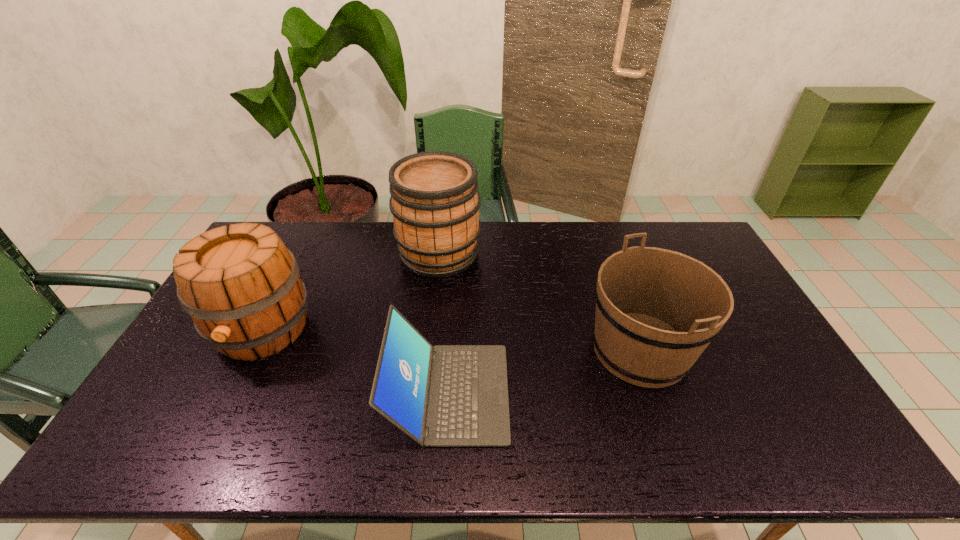
The image size is (960, 540). Find the location of `the farther cider`. the farther cider is located at coordinates (435, 202).

The height and width of the screenshot is (540, 960). Find the location of `the right cider`. the right cider is located at coordinates [435, 202].

You are a GUI agent. You are given a task and a screenshot of the screen. Output one action in this format:
    pyautogui.click(x=<x>, y=<y>)
    Task: Click on the left cider
    
    Given the screenshot: What is the action you would take?
    pyautogui.click(x=241, y=286)

At what (x,y) coordinates should I click in order to perform the action: click on the leftmost object. Please return your answer as a coordinate pair (x, y). The image size is (960, 540). Looking at the image, I should click on (241, 286).

The width and height of the screenshot is (960, 540). Find the location of `the rightmost object`. the rightmost object is located at coordinates (657, 310).

What are the coordinates of `the shortest object` in the screenshot? It's located at (448, 395).

The width and height of the screenshot is (960, 540). Identify the location of vacant position located 0.110m on the left of the right cider. (367, 253).

At what (x,y) coordinates should I click in order to perform the action: click on blank space located on the side of the left cider where the spigot is located. Please return your answer as a coordinate pair (x, y). Looking at the image, I should click on (213, 427).

The image size is (960, 540). I want to click on free space located 0.110m on the front of the rightmost object, so click(x=673, y=440).

The height and width of the screenshot is (540, 960). I want to click on vacant space located on the screen of the shortest object, so tap(600, 393).